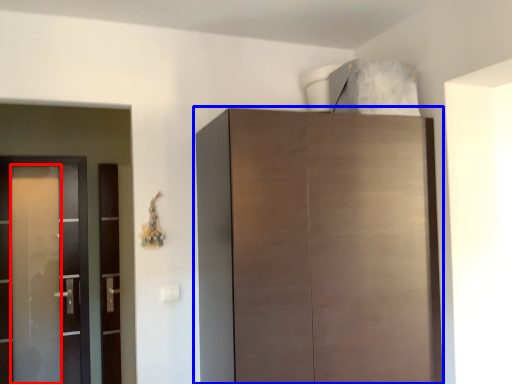
Question: Among these objects, which one is farthest to the camera, screen door (highlighted by a red box) or cupboard (highlighted by a blue box)?

Choices:
 (A) screen door
 (B) cupboard

Answer: (A)